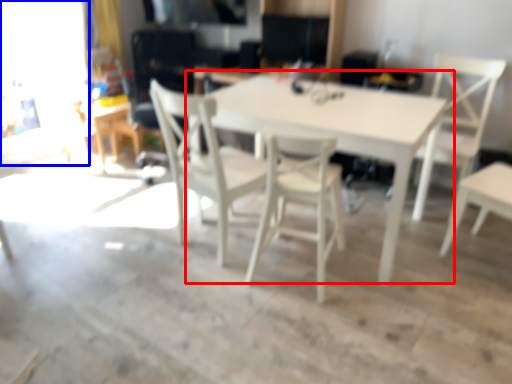
Question: Which of the following is the farthest to the observer, table (highlighted by a red box) or glass door (highlighted by a blue box)?

Choices:
 (A) table
 (B) glass door

Answer: (B)